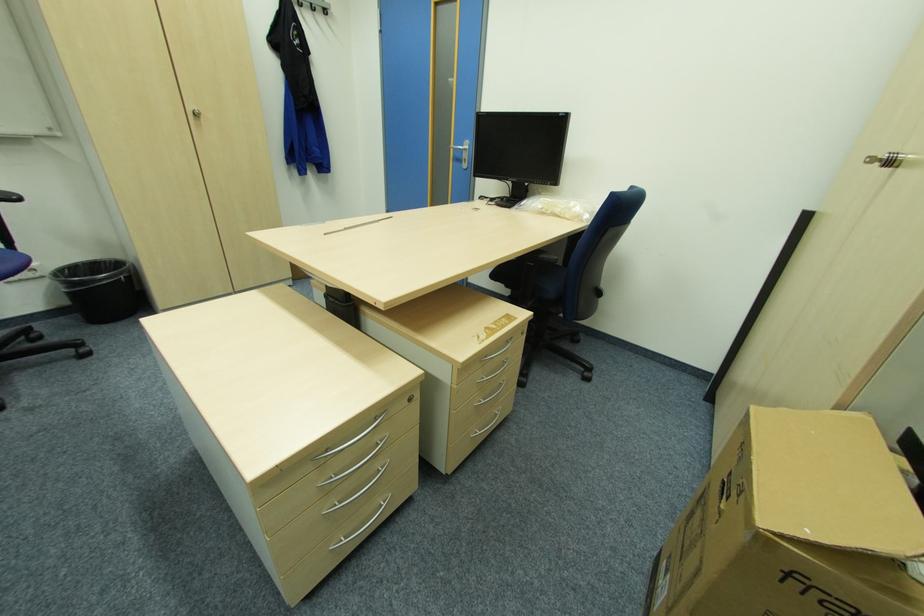
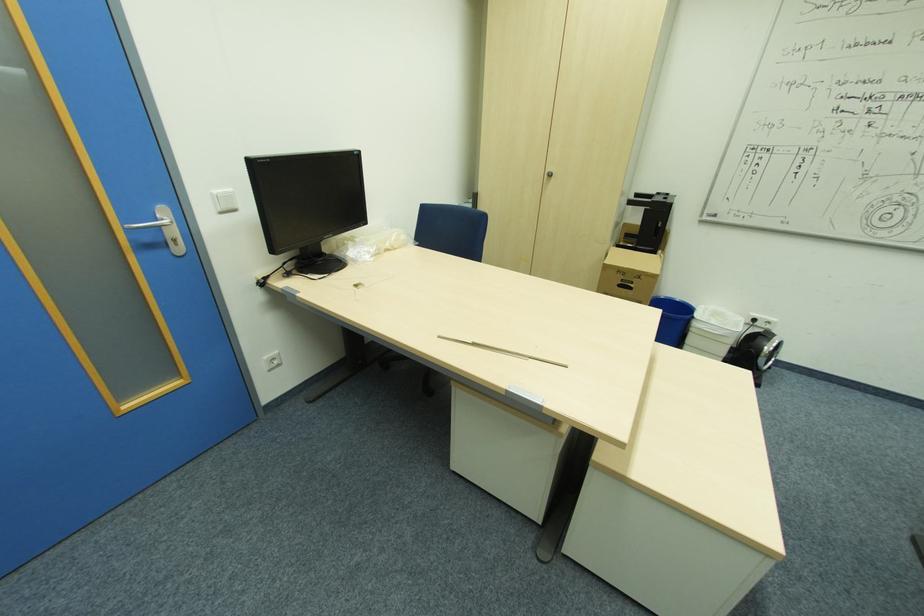
Question: I am providing you with two images of the same scene from different viewpoints. After the viewpoint changes to image2, which objects are now occluded?

Choices:
 (A) yellow wall charger
 (B) blue chair sitting surface
 (C) white paper shredder
 (D) blue trash can

Answer: (B)